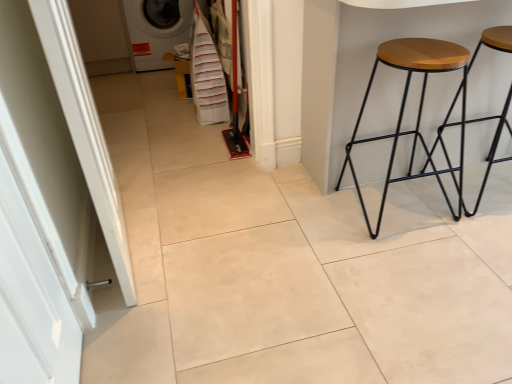
Question: Should I look upward or downward to see white glossy washing machine at upper left?

Choices:
 (A) up
 (B) down

Answer: (A)

Question: Can you see wooden/black metal stool at right, which is counted as the 1th stool, starting from the left, touching white glossy door at left?

Choices:
 (A) yes
 (B) no

Answer: (B)

Question: Is white glossy door at left surrounded by wooden/black metal stool at right, the 2th stool when ordered from right to left?

Choices:
 (A) yes
 (B) no

Answer: (B)

Question: Does wooden/black metal stool at right, the 2th stool when ordered from right to left, have a smaller size compared to white glossy door at left?

Choices:
 (A) no
 (B) yes

Answer: (A)

Question: Is wooden/black metal stool at right, the 2th stool when ordered from right to left, in front of white glossy door at left?

Choices:
 (A) no
 (B) yes

Answer: (A)

Question: Is wooden/black metal stool at right, the 2th stool when ordered from right to left, wider than white glossy door at left?

Choices:
 (A) no
 (B) yes

Answer: (B)

Question: Is wooden/black metal stool at right, the 2th stool when ordered from right to left, taller than white glossy door at left?

Choices:
 (A) yes
 (B) no

Answer: (B)

Question: Is white fabric laundry at center smaller than wooden seat stool at right, which ranks as the 1th stool in right-to-left order?

Choices:
 (A) yes
 (B) no

Answer: (A)

Question: Does white fabric laundry at center have a larger size compared to wooden seat stool at right, which appears as the second stool when viewed from the left?

Choices:
 (A) no
 (B) yes

Answer: (A)

Question: Could you tell me if white fabric laundry at center is facing wooden seat stool at right, which ranks as the 1th stool in right-to-left order?

Choices:
 (A) yes
 (B) no

Answer: (B)

Question: From a real-world perspective, is white fabric laundry at center over wooden seat stool at right, which ranks as the 1th stool in right-to-left order?

Choices:
 (A) yes
 (B) no

Answer: (B)

Question: Is white fabric laundry at center to the left of wooden seat stool at right, which ranks as the 1th stool in right-to-left order, from the viewer's perspective?

Choices:
 (A) no
 (B) yes

Answer: (B)

Question: Can you confirm if white fabric laundry at center is taller than wooden seat stool at right, which ranks as the 1th stool in right-to-left order?

Choices:
 (A) yes
 (B) no

Answer: (B)

Question: Is white glossy door at left at the back of white glossy washing machine at upper left?

Choices:
 (A) yes
 (B) no

Answer: (B)